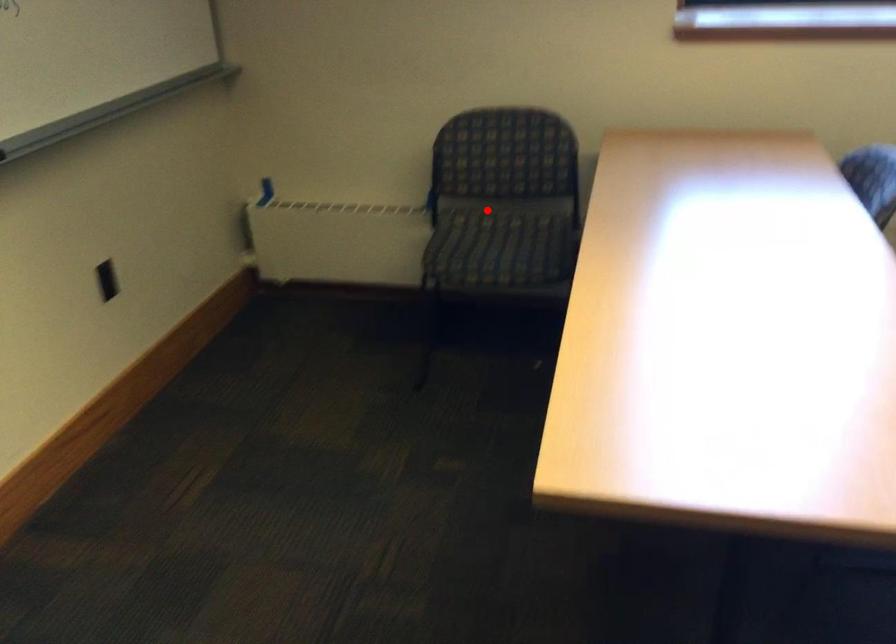
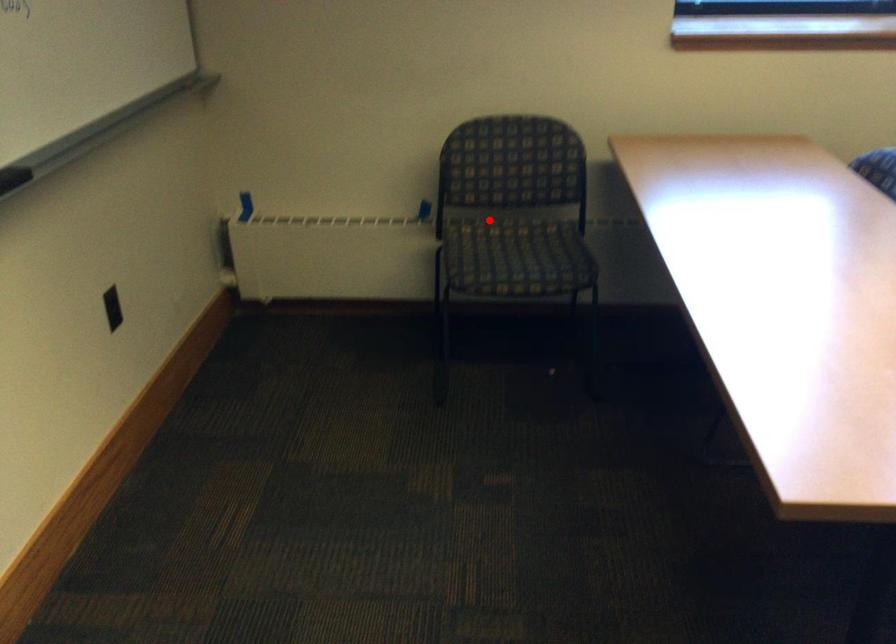
I am providing you with two images of the same scene from different viewpoints. A red point is marked on the first image and another point is marked on the second image. Do the highlighted points in image1 and image2 indicate the same real-world spot?

Yes